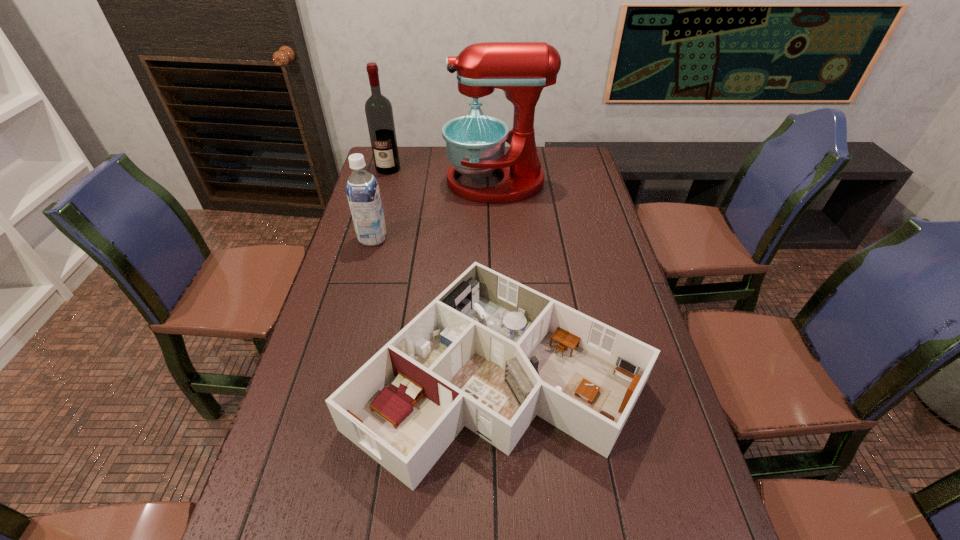
Image resolution: width=960 pixels, height=540 pixels. What are the coordinates of `free space located on the label of the soya milk` in the screenshot? It's located at (453, 238).

Locate an element on the screen. Image resolution: width=960 pixels, height=540 pixels. vacant region located 0.100m on the back of the shortest object is located at coordinates (494, 270).

The image size is (960, 540). I want to click on mixer located in the far edge section of the desktop, so click(475, 144).

I want to click on alcohol that is at the far edge, so click(379, 114).

Where is `alcohol positioned at the left edge`? alcohol positioned at the left edge is located at coordinates (379, 114).

Locate an element on the screen. soya milk situated at the left edge is located at coordinates (362, 189).

The width and height of the screenshot is (960, 540). In order to click on dollhouse that is at the left edge in this screenshot , I will do `click(489, 353)`.

The width and height of the screenshot is (960, 540). Identify the location of object located in the right edge section of the desktop. (489, 353).

Find the location of `object that is at the far left corner`. object that is at the far left corner is located at coordinates (379, 114).

In order to click on vacant area at the left edge in this screenshot , I will do `click(332, 276)`.